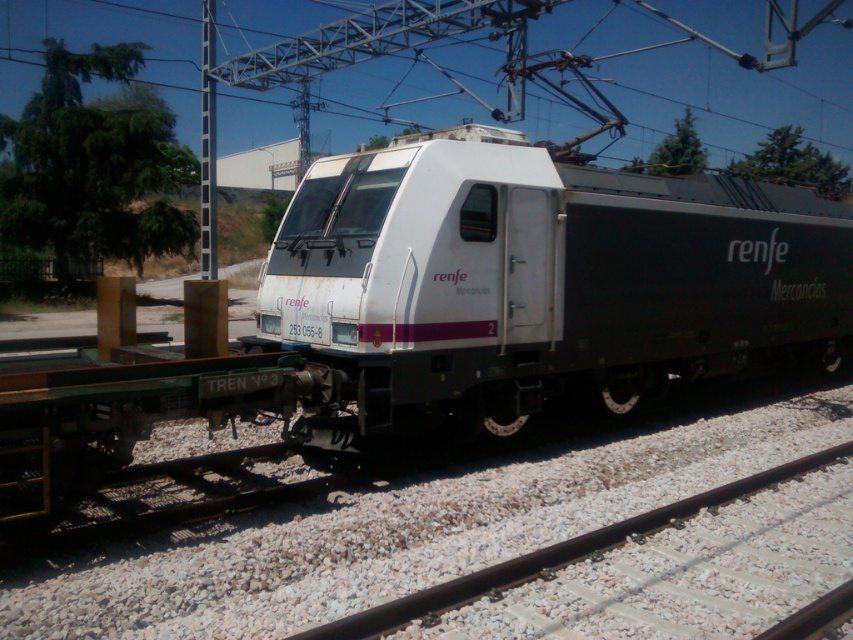
You are a photographer setting up a shot of the white matte train at center and the black metal train track at lower center. You want to ensure both are in focus. Which object should you adjust your camera focus on first if you want the larger object to be sharp?

The white matte train at center is bigger than the black metal train track at lower center, so you should focus on the white matte train at center first to ensure it appears sharp in the photograph.